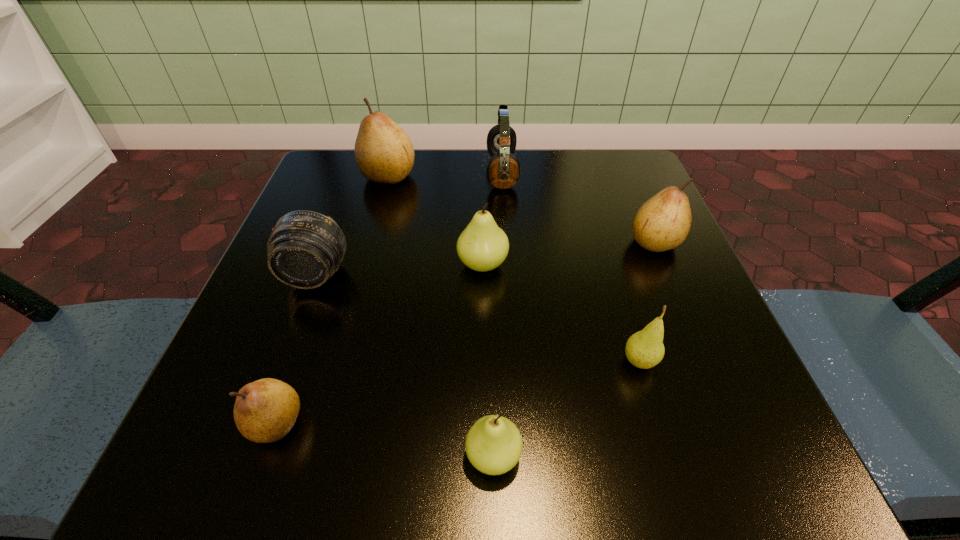
Locate an element on the screen. This screenshot has height=540, width=960. the farthest brown pear is located at coordinates (384, 153).

Identify the location of the biggest brown pear. (384, 153).

This screenshot has width=960, height=540. I want to click on headset, so click(503, 171).

In order to click on the rightmost pear in this screenshot , I will do `click(663, 222)`.

Where is `the rightmost object`? The height and width of the screenshot is (540, 960). the rightmost object is located at coordinates (663, 222).

This screenshot has width=960, height=540. Find the location of `the farther green pear`. the farther green pear is located at coordinates (483, 246).

Image resolution: width=960 pixels, height=540 pixels. Find the location of `telephoto lens`. telephoto lens is located at coordinates (305, 248).

Where is `the seventh object from left to right`? The width and height of the screenshot is (960, 540). the seventh object from left to right is located at coordinates click(x=644, y=349).

The width and height of the screenshot is (960, 540). I want to click on the fifth pear from left to right, so click(x=644, y=349).

Find the location of a particular element. the smallest brown pear is located at coordinates (265, 410).